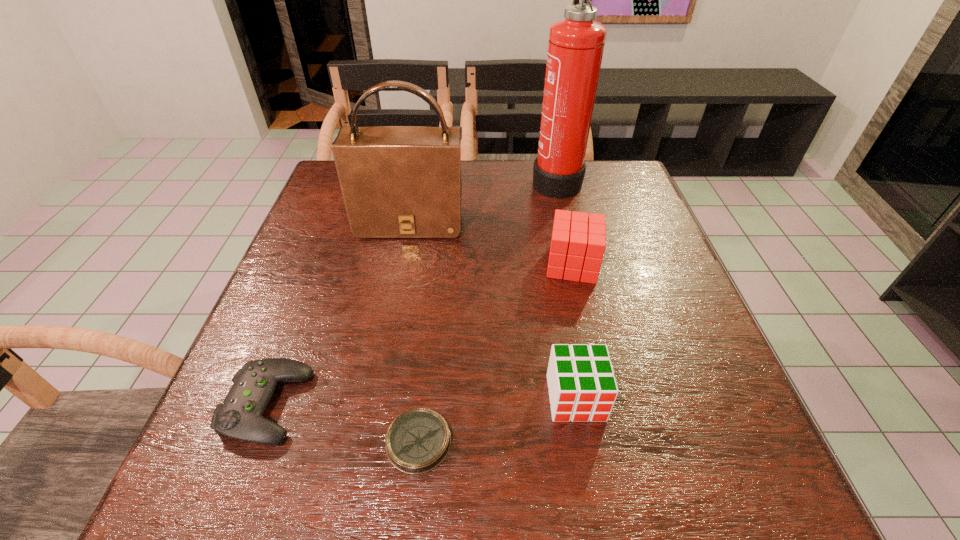
What are the coordinates of `shoulder bag that is positioned at the left edge` in the screenshot? It's located at (397, 181).

Where is `control present at the left edge`? This screenshot has width=960, height=540. control present at the left edge is located at coordinates (240, 417).

Identify the location of object that is at the right edge. The image size is (960, 540). point(575,49).

In order to click on object at the far right corner in this screenshot , I will do `click(575, 49)`.

Where is `vacant region at the near edge of the desktop`? vacant region at the near edge of the desktop is located at coordinates (368, 502).

The image size is (960, 540). In the image, there is a desktop. In order to click on free space at the left edge in this screenshot , I will do `click(267, 324)`.

At what (x,y) coordinates should I click in order to perform the action: click on vacant position at the right edge of the desktop. Please return your answer as a coordinate pair (x, y). The image size is (960, 540). Looking at the image, I should click on (685, 355).

In the image, there is a desktop. Identify the location of vacant space at the near left corner. (197, 509).

In the image, there is a desktop. Identify the location of vacant space at the far right corner. This screenshot has width=960, height=540. (607, 167).

The width and height of the screenshot is (960, 540). Identify the location of vacant space at the near right corner of the desktop. (693, 491).